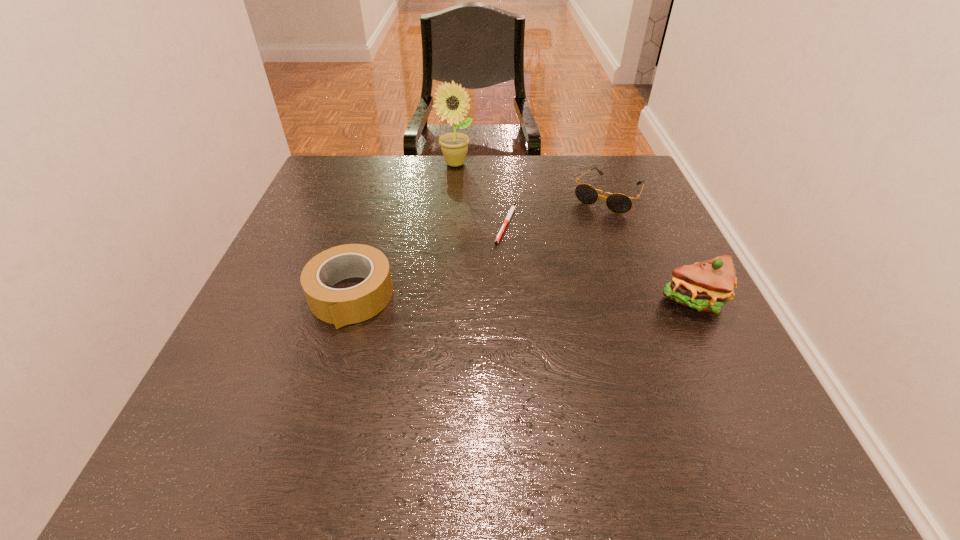
The image size is (960, 540). I want to click on object at the left edge, so click(341, 307).

The height and width of the screenshot is (540, 960). I want to click on sandwich that is at the right edge, so click(x=704, y=286).

Where is `sunglasses present at the right edge`? The width and height of the screenshot is (960, 540). sunglasses present at the right edge is located at coordinates point(618,203).

Locate an element on the screen. object positioned at the far right corner is located at coordinates (618, 203).

Find the location of a particular element. vacant region at the far edge of the desktop is located at coordinates (451, 197).

Find the location of a particular element. The height and width of the screenshot is (540, 960). free space at the near edge of the desktop is located at coordinates (448, 389).

In the image, there is a desktop. Where is `vacant space at the left edge`? The image size is (960, 540). vacant space at the left edge is located at coordinates (234, 343).

In the image, there is a desktop. At what (x,y) coordinates should I click in order to perform the action: click on vacant space at the right edge. Please return your answer as a coordinate pair (x, y). The height and width of the screenshot is (540, 960). Looking at the image, I should click on (678, 322).

Find the location of `vacant region at the far left corner of the desktop`. vacant region at the far left corner of the desktop is located at coordinates (311, 193).

Where is `vacant point located between the tallest object and the sunglasses`? The width and height of the screenshot is (960, 540). vacant point located between the tallest object and the sunglasses is located at coordinates (532, 179).